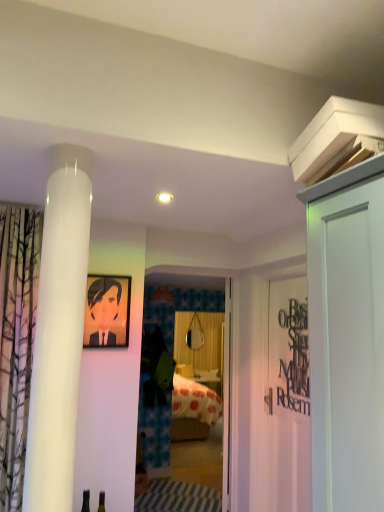
Question: Should I look upward or downward to see matte black picture frame at upper left?

Choices:
 (A) up
 (B) down

Answer: (B)

Question: From the image's perspective, would you say white matte door at upper right, the first door when ordered from right to left, is positioned over black matte sign at right?

Choices:
 (A) no
 (B) yes

Answer: (B)

Question: Is white matte door at upper right, which is counted as the first door, starting from the front, outside of black matte sign at right?

Choices:
 (A) no
 (B) yes

Answer: (B)

Question: Is white matte door at upper right, which is counted as the first door, starting from the front, positioned behind black matte sign at right?

Choices:
 (A) no
 (B) yes

Answer: (A)

Question: Can you confirm if white matte door at upper right, acting as the second door starting from the left, is thinner than black matte sign at right?

Choices:
 (A) no
 (B) yes

Answer: (A)

Question: Is white matte door at upper right, acting as the second door starting from the left, taller than black matte sign at right?

Choices:
 (A) yes
 (B) no

Answer: (A)

Question: Does white matte door at upper right, which is counted as the first door, starting from the front, have a greater width compared to black matte sign at right?

Choices:
 (A) yes
 (B) no

Answer: (A)

Question: Can we say black matte sign at right lies outside transparent glass door at center?

Choices:
 (A) yes
 (B) no

Answer: (A)

Question: Considering the relative sizes of black matte sign at right and transparent glass door at center in the image provided, is black matte sign at right bigger than transparent glass door at center?

Choices:
 (A) no
 (B) yes

Answer: (A)

Question: Is black matte sign at right further to the viewer compared to transparent glass door at center?

Choices:
 (A) no
 (B) yes

Answer: (A)

Question: Does black matte sign at right have a greater width compared to transparent glass door at center?

Choices:
 (A) no
 (B) yes

Answer: (A)

Question: Are black matte sign at right and transparent glass door at center located far from each other?

Choices:
 (A) no
 (B) yes

Answer: (B)

Question: Does black matte sign at right have a smaller size compared to transparent glass door at center?

Choices:
 (A) yes
 (B) no

Answer: (A)

Question: From a real-world perspective, is matte black picture frame at upper left physically below white matte door at upper right, which is counted as the first door, starting from the front?

Choices:
 (A) no
 (B) yes

Answer: (A)